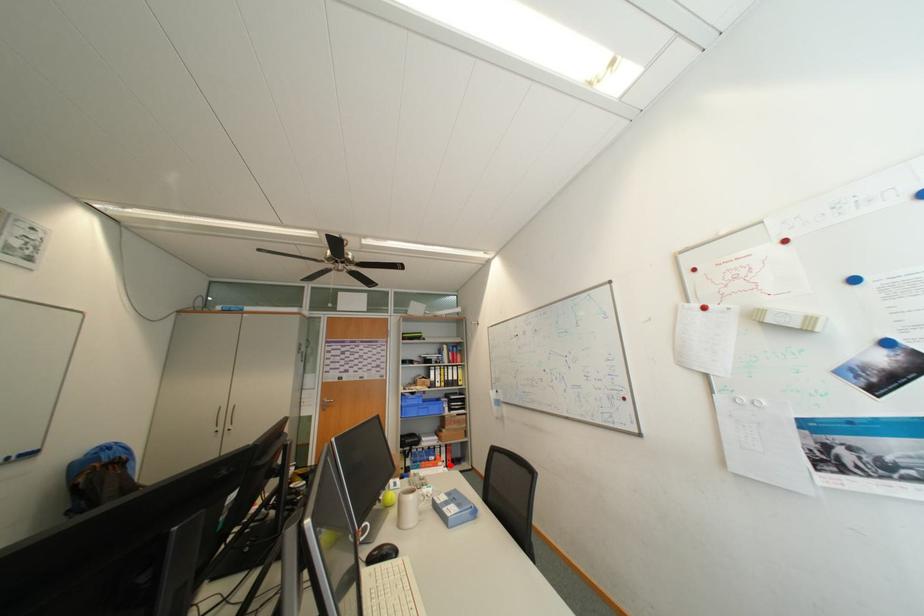
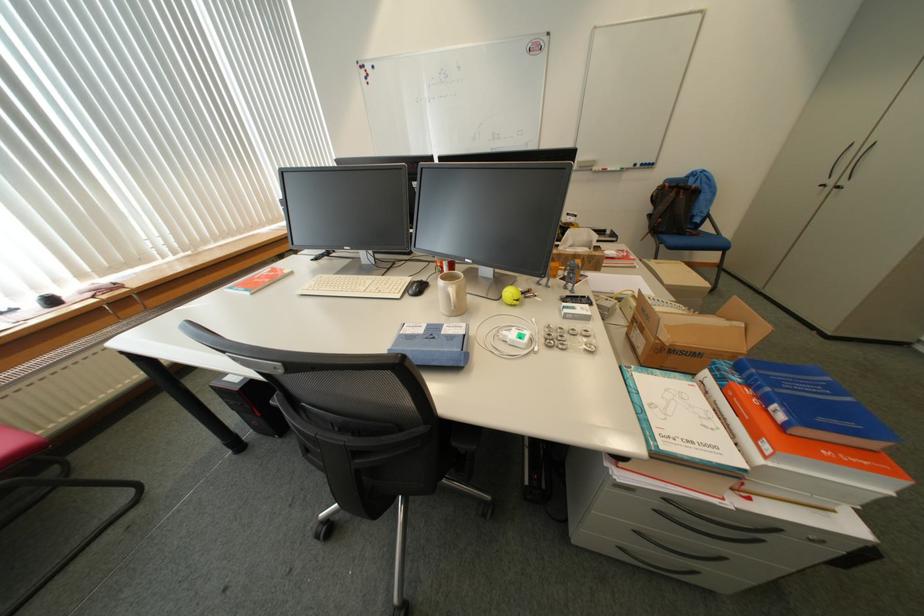
Question: A red point is marked in image1. In image2, is the corresponding 3D point closer to the camera or farther? Reply with the corresponding letter.

Choices:
 (A) The corresponding 3D point is closer.
 (B) The corresponding 3D point is farther.

Answer: (B)